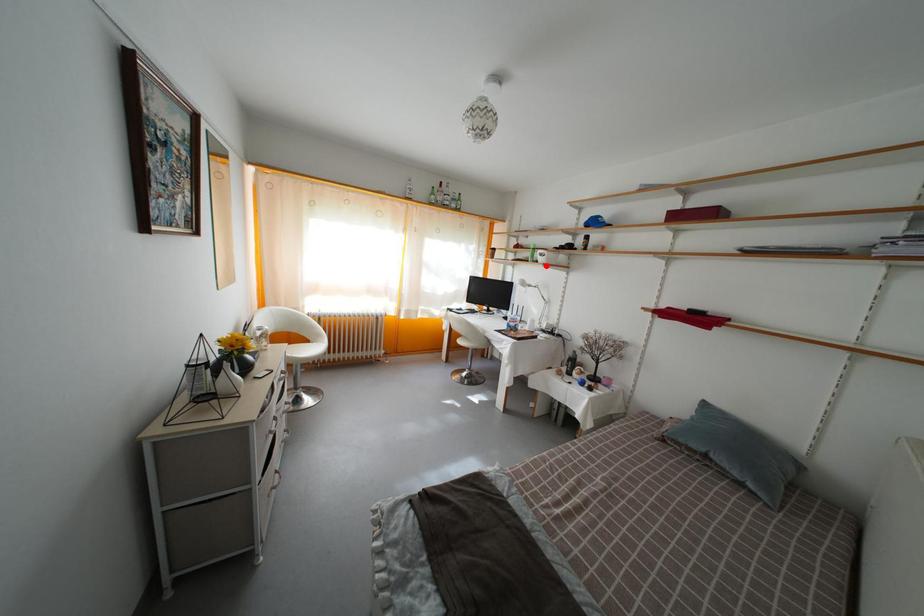
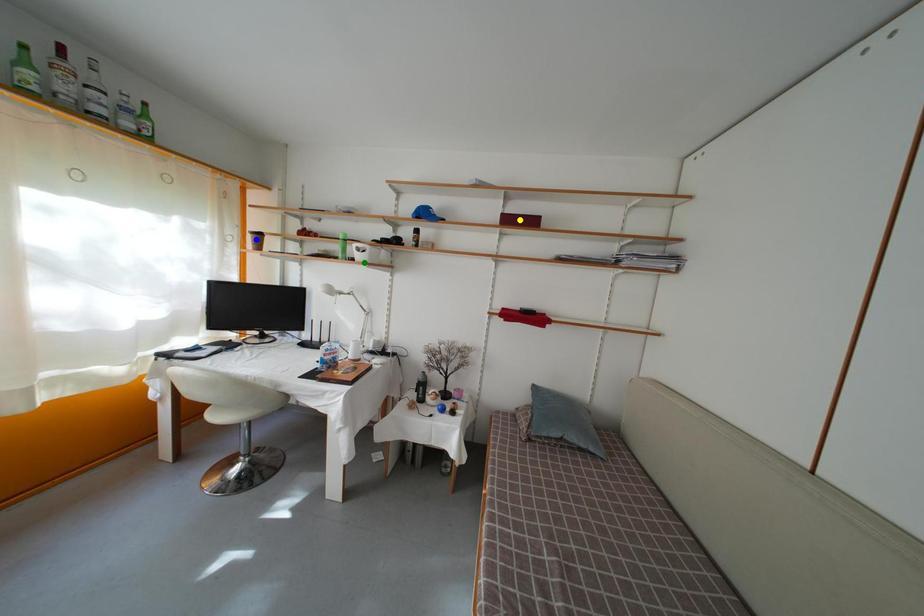
Question: I am providing you with two images of the same scene from different viewpoints. A red point is marked on the first image. You are given multiple points on the second image. Which point in image 2 is actually the same real-world point as the red point in image 1?

Choices:
 (A) blue point
 (B) green point
 (C) yellow point

Answer: (B)